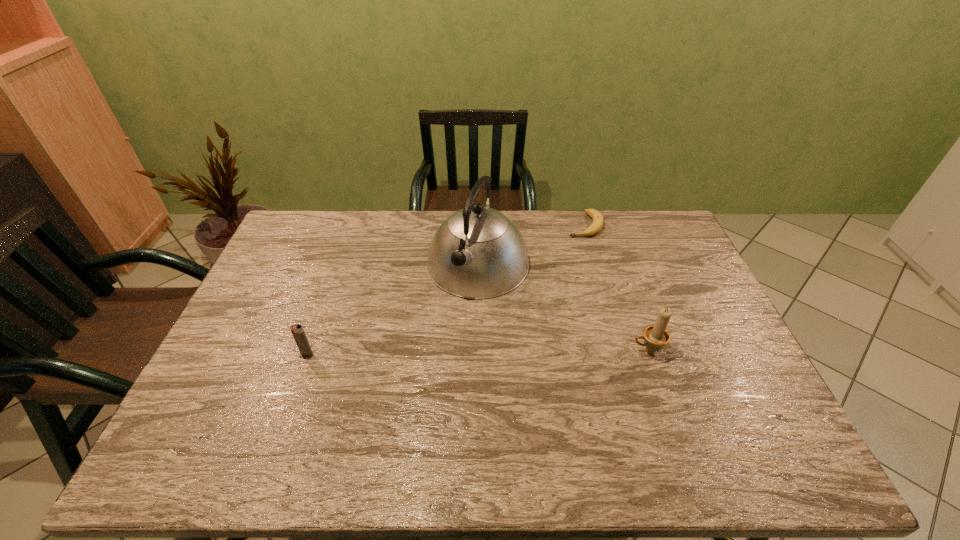
Image resolution: width=960 pixels, height=540 pixels. In the image, there is a desktop. Identify the location of free space at the left edge. (250, 359).

The image size is (960, 540). In order to click on free space at the right edge of the desktop in this screenshot , I will do `click(653, 268)`.

Find the location of a particular element. vacant space at the far left corner of the desktop is located at coordinates (307, 235).

Locate an element on the screen. Image resolution: width=960 pixels, height=540 pixels. vacant space at the far right corner is located at coordinates (639, 235).

Identify the location of vacant area between the third object from right to left and the candle_holder. (563, 307).

I want to click on free space between the candle_holder and the leftmost object, so click(477, 352).

The height and width of the screenshot is (540, 960). Identify the location of vacant area that lies between the shortest object and the second tallest object. (616, 287).

You are a GUI agent. You are given a task and a screenshot of the screen. Output one action in this format:
    pyautogui.click(x=<x>, y=<y>)
    Task: Click on the empty location between the candle_holder and the third tallest object
    The image size is (960, 540).
    Given the screenshot: What is the action you would take?
    pyautogui.click(x=477, y=352)

Locate an element on the screen. This screenshot has width=960, height=540. free space between the third object from right to left and the shortest object is located at coordinates (531, 245).

Locate an element on the screen. The image size is (960, 540). vacant area between the banana and the second tallest object is located at coordinates (616, 287).